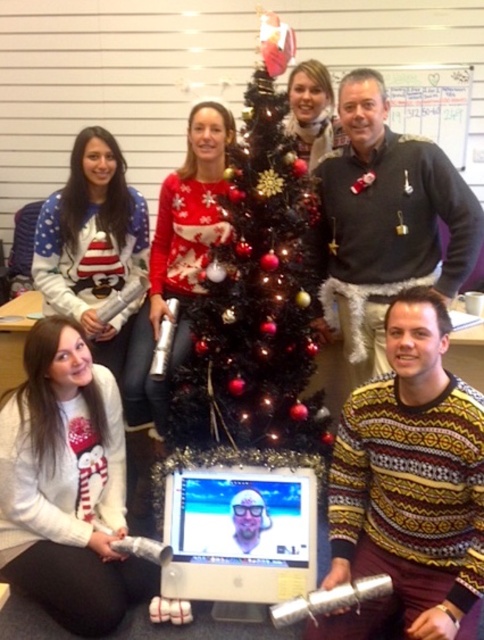
Which is in front, point (445, 396) or point (136, 586)?

Positioned in front is point (445, 396).

From the picture: Measure the distance between yellow and brown sweater at center and camera.

yellow and brown sweater at center and camera are 1.60 meters apart.

Is point (347, 488) farther from camera compared to point (75, 625)?

Yes, it is.

The image size is (484, 640). I want to click on yellow and brown sweater at center, so click(x=408, y=484).

Can you confirm if yellow and brown sweater at center is thinner than matte white sweater at center?

Incorrect, yellow and brown sweater at center's width is not less than matte white sweater at center's.

Can you confirm if yellow and brown sweater at center is shorter than matte white sweater at center?

In fact, yellow and brown sweater at center may be taller than matte white sweater at center.

Is point (406, 500) more distant than point (306, 80)?

No, (406, 500) is in front of (306, 80).

Identify the location of yellow and brown sweater at center. (408, 484).

Which of these two, dark gray sweater at upper center or matte white sweater at center, stands shorter?

Result: Standing shorter between the two is matte white sweater at center.

Is dark gray sweater at upper center to the right of matte white sweater at center from the viewer's perspective?

Yes, dark gray sweater at upper center is to the right of matte white sweater at center.

Is point (381, 227) farther from viewer compared to point (319, 131)?

No, (381, 227) is in front of (319, 131).

This screenshot has height=640, width=484. Identify the location of dark gray sweater at upper center. [383, 228].